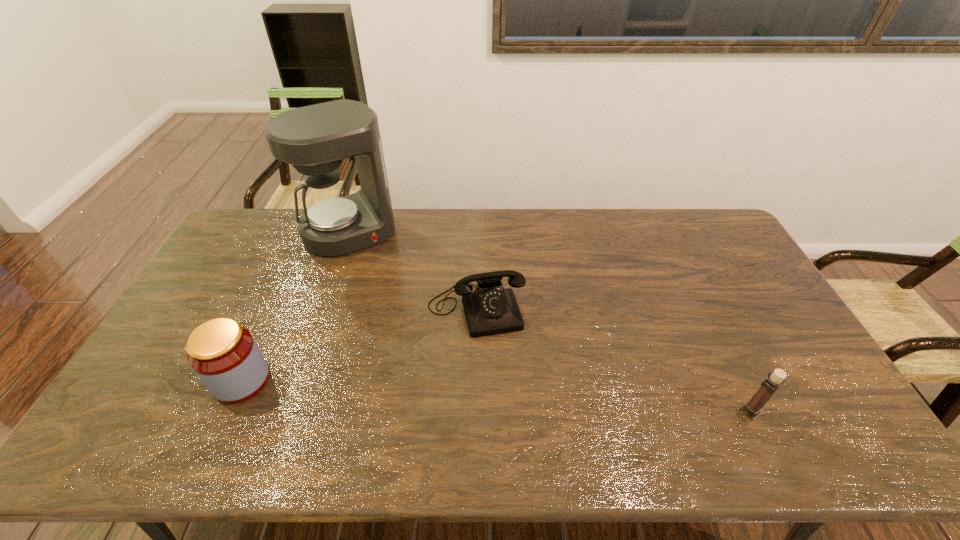
I want to click on empty location between the coffee maker and the candle holder, so click(x=551, y=321).

You are a GUI agent. You are given a task and a screenshot of the screen. Output one action in this format:
    pyautogui.click(x=<x>, y=<y>)
    Task: Click on the empty location between the rightmost object and the jar
    The image size is (960, 540).
    Given the screenshot: What is the action you would take?
    pyautogui.click(x=496, y=396)

The height and width of the screenshot is (540, 960). Find the location of `free space between the jar and the shortest object`. free space between the jar and the shortest object is located at coordinates (359, 345).

Identify which object is located as the second nearest to the coffee maker. Please provide its 2D coordinates. Your answer should be formatted as a tuple, i.e. [(x, y)], where the tuple contains the x and y coordinates of a point satisfying the conditions above.

[(224, 355)]

You are a GUI agent. You are given a task and a screenshot of the screen. Output one action in this format:
    pyautogui.click(x=<x>, y=<y>)
    Task: Click on the object identified as the third closest to the tallest object
    This screenshot has height=540, width=960.
    Given the screenshot: What is the action you would take?
    pyautogui.click(x=776, y=379)

At what (x,y) coordinates should I click in order to perform the action: click on free location that satisfies the following two spatial constraints: 1. on the front side of the jar; 2. on the left side of the rightmost object. Please return your answer as a coordinate pair (x, y). The image size is (960, 540). Looking at the image, I should click on (228, 411).

Find the location of `vacant area that satisfies the following two spatial constraints: 1. on the front side of the rightmost object; 2. on the left side of the jar`. vacant area that satisfies the following two spatial constraints: 1. on the front side of the rightmost object; 2. on the left side of the jar is located at coordinates (228, 411).